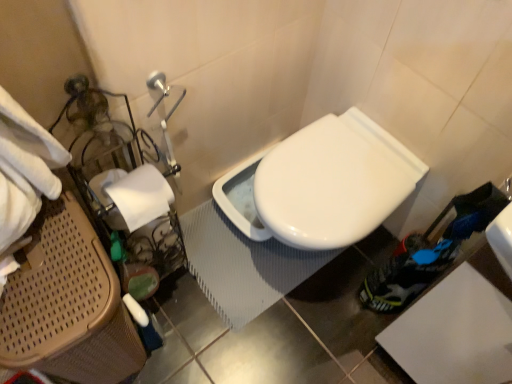
Image resolution: width=512 pixels, height=384 pixels. Identify the location of free space above white glossy toilet at center (from a real-world perspective). (334, 178).